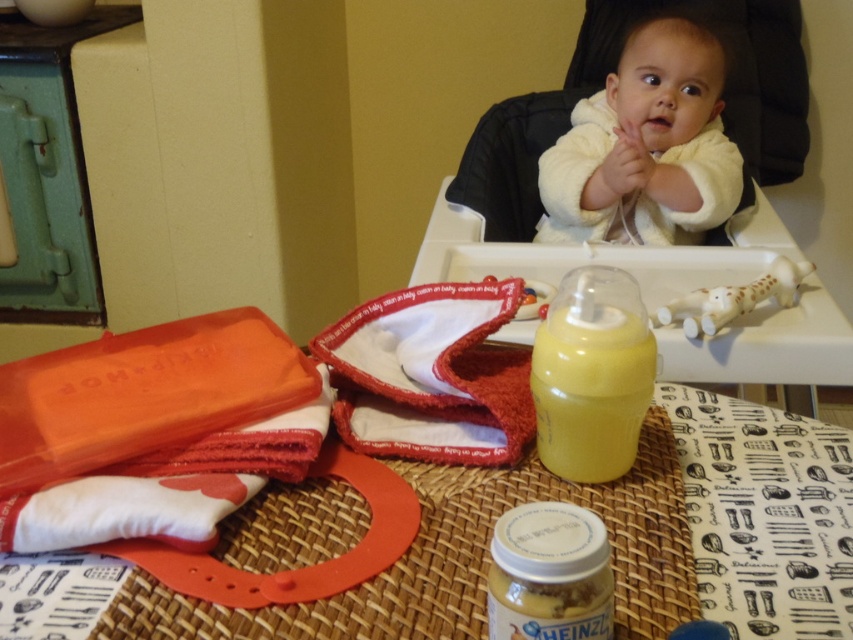
Does white fluffy baby at upper center appear on the left side of white plastic teething toy at upper right?

Correct, you'll find white fluffy baby at upper center to the left of white plastic teething toy at upper right.

You are a GUI agent. You are given a task and a screenshot of the screen. Output one action in this format:
    pyautogui.click(x=<x>, y=<y>)
    Task: Click on the white fluffy baby at upper center
    The width and height of the screenshot is (853, 640).
    Given the screenshot: What is the action you would take?
    pyautogui.click(x=646, y=147)

Locate an element on the screen. Image resolution: width=853 pixels, height=640 pixels. white fluffy baby at upper center is located at coordinates (646, 147).

Who is positioned more to the right, white fluffy baby at upper center or yellow translucent bottle at center?

Positioned to the right is white fluffy baby at upper center.

Can you confirm if white fluffy baby at upper center is taller than yellow translucent bottle at center?

Correct, white fluffy baby at upper center is much taller as yellow translucent bottle at center.

Locate an element on the screen. white fluffy baby at upper center is located at coordinates (646, 147).

Is yellow translucent bottle at center positioned before white plastic teething toy at upper right?

That is True.

This screenshot has width=853, height=640. Describe the element at coordinates (590, 392) in the screenshot. I see `yellow translucent bottle at center` at that location.

This screenshot has width=853, height=640. I want to click on yellow translucent bottle at center, so click(590, 392).